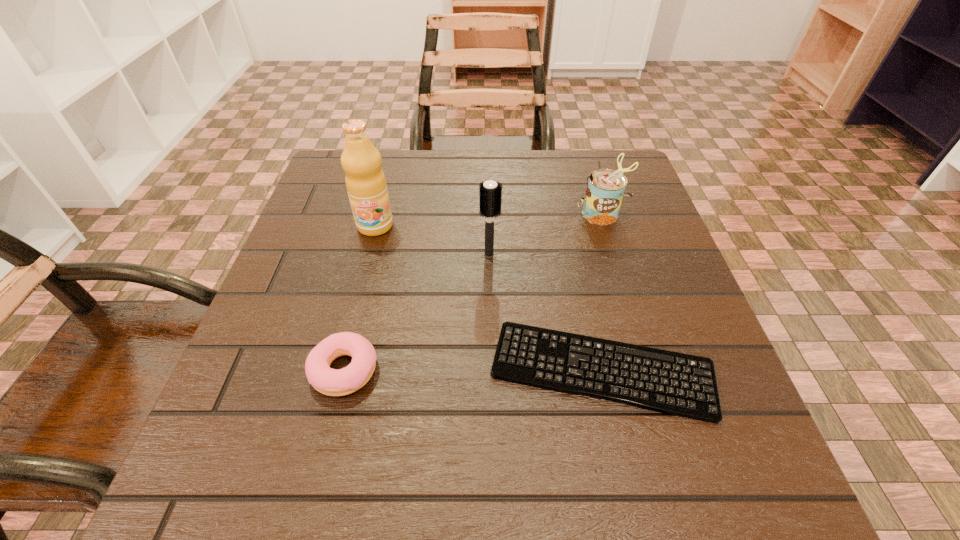
The height and width of the screenshot is (540, 960). Identify the location of vacant space that's between the third farthest object and the tallest object. (432, 240).

At what (x,y) coordinates should I click in order to perform the action: click on vacant area that lies between the fruit juice and the hairbrush. Please return your answer as a coordinate pair (x, y). Looking at the image, I should click on (432, 240).

At what (x,y) coordinates should I click in order to perform the action: click on free space that is in between the computer keyboard and the can. Please return your answer as a coordinate pair (x, y). Looking at the image, I should click on (602, 292).

Locate an element on the screen. The width and height of the screenshot is (960, 540). the third closest object relative to the second tallest object is located at coordinates (366, 185).

Locate which object is the closest to the third shortest object. Please provide its 2D coordinates. Your answer should be formatted as a tuple, i.e. [(x, y)], where the tuple contains the x and y coordinates of a point satisfying the conditions above.

[(490, 193)]

Where is `free space that satisfies the following two spatial constraints: 1. on the front label of the computer keyboard; 2. on the right side of the tallest object`? The width and height of the screenshot is (960, 540). free space that satisfies the following two spatial constraints: 1. on the front label of the computer keyboard; 2. on the right side of the tallest object is located at coordinates (338, 370).

Locate an element on the screen. The image size is (960, 540). vacant area that satisfies the following two spatial constraints: 1. on the front label of the shortest object; 2. on the right side of the fruit juice is located at coordinates (338, 370).

Where is `free location that satisfies the following two spatial constraints: 1. on the front label of the fruit juice; 2. on the right side of the shortest object`? This screenshot has height=540, width=960. free location that satisfies the following two spatial constraints: 1. on the front label of the fruit juice; 2. on the right side of the shortest object is located at coordinates (338, 370).

Locate an element on the screen. The width and height of the screenshot is (960, 540). vacant space that satisfies the following two spatial constraints: 1. on the front label of the computer keyboard; 2. on the left side of the tallest object is located at coordinates (338, 370).

The image size is (960, 540). What are the coordinates of `blank area in the image that satisfies the following two spatial constraints: 1. on the front label of the fourth tallest object; 2. on the left side of the tallest object` in the screenshot? It's located at coord(338,370).